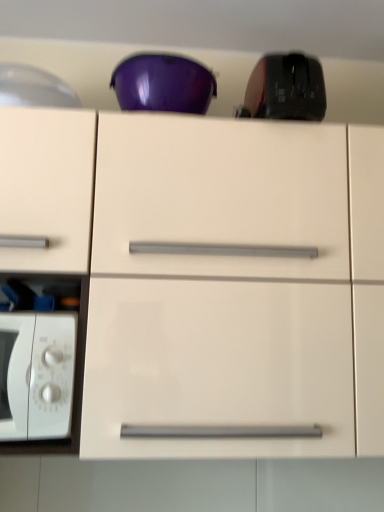
Question: Does white glossy microwave oven at left have a smaller size compared to glossy white cabinet at center?

Choices:
 (A) no
 (B) yes

Answer: (B)

Question: From the image's perspective, is white glossy microwave oven at left on glossy white cabinet at center?

Choices:
 (A) no
 (B) yes

Answer: (A)

Question: Can glossy white cabinet at center be found inside white glossy microwave oven at left?

Choices:
 (A) yes
 (B) no

Answer: (B)

Question: Is white glossy microwave oven at left shorter than glossy white cabinet at center?

Choices:
 (A) no
 (B) yes

Answer: (B)

Question: Is white glossy microwave oven at left oriented towards glossy white cabinet at center?

Choices:
 (A) no
 (B) yes

Answer: (B)

Question: From a real-world perspective, is glossy white cabinet at center physically located above or below white glossy microwave oven at left?

Choices:
 (A) above
 (B) below

Answer: (A)

Question: Visually, is glossy white cabinet at center positioned to the left or to the right of white glossy microwave oven at left?

Choices:
 (A) right
 (B) left

Answer: (A)

Question: Considering the positions of glossy white cabinet at center and white glossy microwave oven at left in the image, is glossy white cabinet at center wider or thinner than white glossy microwave oven at left?

Choices:
 (A) wide
 (B) thin

Answer: (A)

Question: Considering the positions of point (327, 196) and point (72, 351), is point (327, 196) closer or farther from the camera than point (72, 351)?

Choices:
 (A) closer
 (B) farther

Answer: (B)

Question: Would you say black matte mouse at upper right is to the left or to the right of glossy white cabinet at center in the picture?

Choices:
 (A) left
 (B) right

Answer: (B)

Question: Is point (254, 91) closer or farther from the camera than point (158, 280)?

Choices:
 (A) farther
 (B) closer

Answer: (A)

Question: Is black matte mouse at upper right taller or shorter than glossy white cabinet at center?

Choices:
 (A) short
 (B) tall

Answer: (A)

Question: From the image's perspective, relative to glossy white cabinet at center, is black matte mouse at upper right above or below?

Choices:
 (A) above
 (B) below

Answer: (A)

Question: From a real-world perspective, is white glossy microwave oven at left physically located above or below glossy white cabinet at center?

Choices:
 (A) below
 (B) above

Answer: (A)

Question: Considering the positions of white glossy microwave oven at left and glossy white cabinet at center in the image, is white glossy microwave oven at left wider or thinner than glossy white cabinet at center?

Choices:
 (A) thin
 (B) wide

Answer: (A)